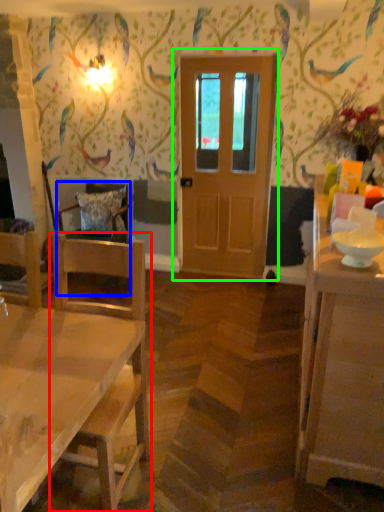
Question: Which object is the farthest from chair (highlighted by a red box)? Choose among these: chair (highlighted by a blue box) or door (highlighted by a green box).

Choices:
 (A) chair
 (B) door

Answer: (B)